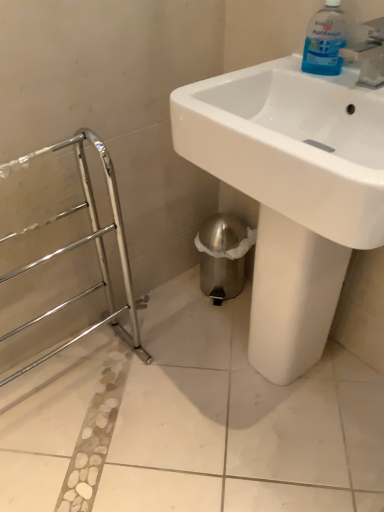
Question: Can you confirm if white glossy sink at center is bigger than blue translucent plastic handwash at upper right?

Choices:
 (A) no
 (B) yes

Answer: (B)

Question: From a real-world perspective, is white glossy sink at center below blue translucent plastic handwash at upper right?

Choices:
 (A) yes
 (B) no

Answer: (A)

Question: Is white glossy sink at center at the right side of blue translucent plastic handwash at upper right?

Choices:
 (A) yes
 (B) no

Answer: (B)

Question: Are white glossy sink at center and blue translucent plastic handwash at upper right far apart?

Choices:
 (A) yes
 (B) no

Answer: (B)

Question: Is white glossy sink at center further to camera compared to blue translucent plastic handwash at upper right?

Choices:
 (A) yes
 (B) no

Answer: (B)

Question: Is white glossy sink at center closer to the viewer compared to blue translucent plastic handwash at upper right?

Choices:
 (A) no
 (B) yes

Answer: (B)

Question: Is blue translucent plastic handwash at upper right smaller than white glossy sink at center?

Choices:
 (A) no
 (B) yes

Answer: (B)

Question: Can you confirm if blue translucent plastic handwash at upper right is positioned to the right of white glossy sink at center?

Choices:
 (A) no
 (B) yes

Answer: (B)

Question: Is blue translucent plastic handwash at upper right bigger than white glossy sink at center?

Choices:
 (A) yes
 (B) no

Answer: (B)

Question: Considering the relative sizes of blue translucent plastic handwash at upper right and white glossy sink at center in the image provided, is blue translucent plastic handwash at upper right shorter than white glossy sink at center?

Choices:
 (A) no
 (B) yes

Answer: (B)

Question: Is blue translucent plastic handwash at upper right turned away from white glossy sink at center?

Choices:
 (A) no
 (B) yes

Answer: (B)

Question: Does blue translucent plastic handwash at upper right lie behind white glossy sink at center?

Choices:
 (A) no
 (B) yes

Answer: (B)

Question: In terms of height, does white glossy sink at center look taller or shorter compared to blue translucent plastic handwash at upper right?

Choices:
 (A) tall
 (B) short

Answer: (A)